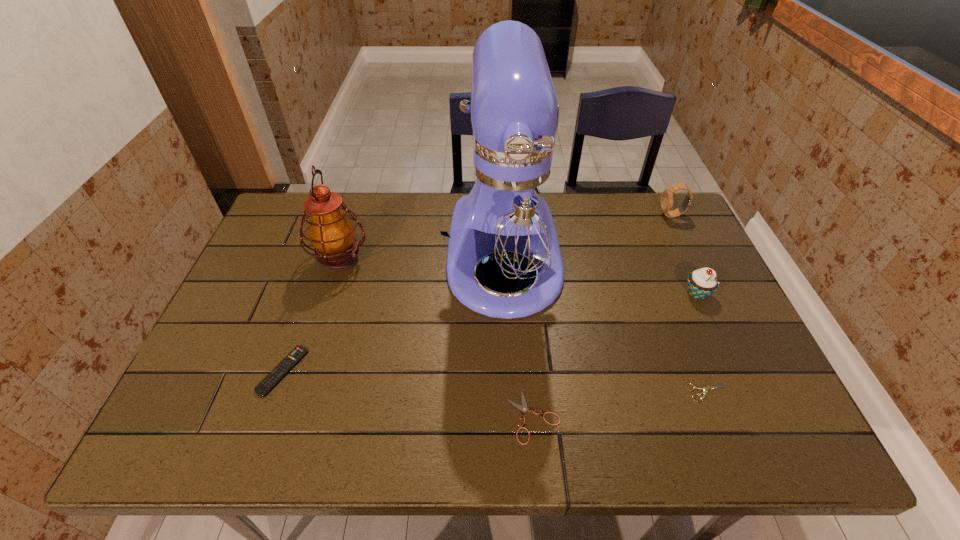
Where is `empty space between the right shears and the left shears`? empty space between the right shears and the left shears is located at coordinates (620, 405).

This screenshot has width=960, height=540. I want to click on free point between the watch and the left shears, so click(603, 316).

The height and width of the screenshot is (540, 960). In order to click on free area in between the third shortest object and the tallest object in this screenshot , I will do `click(394, 313)`.

This screenshot has height=540, width=960. I want to click on vacant area that lies between the fifth tallest object and the oil lamp, so click(x=311, y=315).

At what (x,y) coordinates should I click in order to perform the action: click on free space between the second tallest object and the left shears. Please return your answer as a coordinate pair (x, y). Looking at the image, I should click on tap(437, 338).

Find the location of `free spot between the right shears and the left shears`. free spot between the right shears and the left shears is located at coordinates (620, 405).

You are a GUI agent. You are given a task and a screenshot of the screen. Output one action in this format:
    pyautogui.click(x=<x>, y=<y>)
    Task: Click on the blank region between the remote control and the right shears
    The image size is (960, 540).
    Given the screenshot: What is the action you would take?
    pyautogui.click(x=495, y=382)

Locate an element on the screen. Image resolution: width=960 pixels, height=540 pixels. free point between the left shears and the cupcake is located at coordinates (615, 355).

Find the location of a particular element. free space between the oil lamp and the right shears is located at coordinates (523, 326).

Identify which object is the third closest to the oil lamp. Please provide its 2D coordinates. Your answer should be formatted as a tuple, i.e. [(x, y)], where the tuple contains the x and y coordinates of a point satisfying the conditions above.

[(523, 408)]